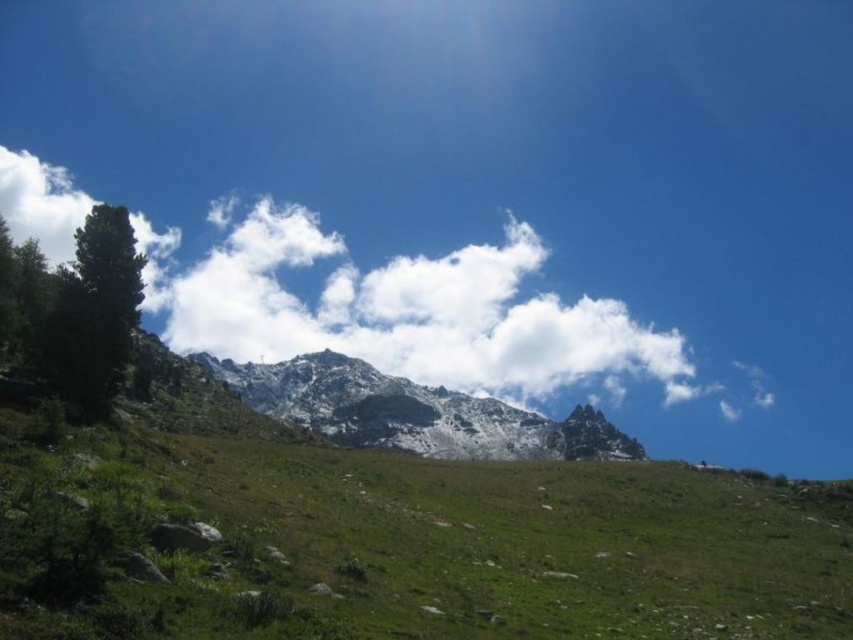
You are standing at the point with coordinates point (345, 387) and want to walk towards the point with coordinates point (480, 596). According to the image, will you be moving towards or away from the snow capped mountains in the mid ground?

Point (480, 596) is in front of point (345, 387). Since the snow capped mountains are in the mid ground, moving towards point (480, 596) means you are moving away from the snow capped mountains in the mid ground.